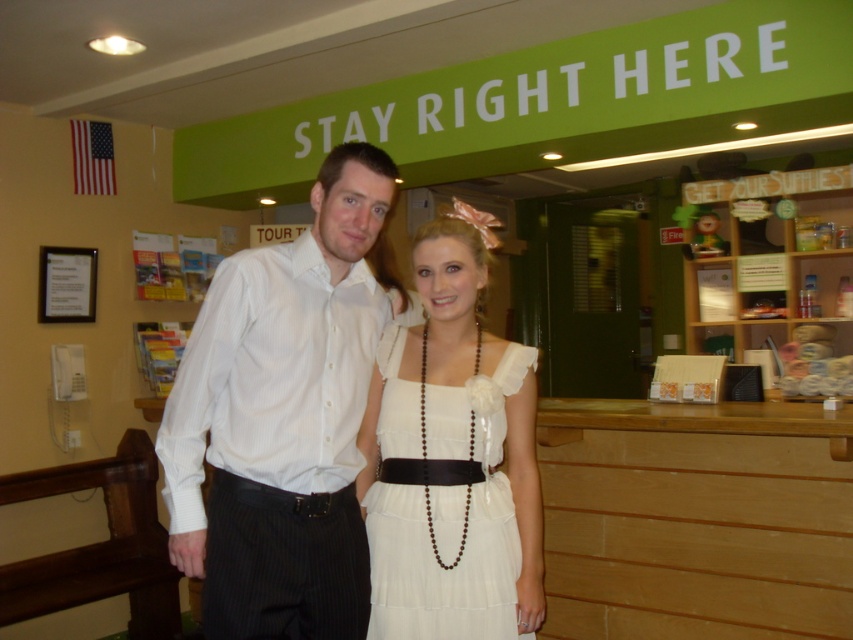
You are a photographer standing at the camera position. You want to place a 2.5 meter long banner between the wooden at right and the camera. Will the banner fit?

The wooden at right is 2.46 meters from the camera. The banner is 2.5 meters long, so it will not fit as the distance is slightly shorter than the banner.

What is the exact location of the white striped shirt at center in the image?

The white striped shirt at center is located at point 0.653 in the x coordinate and 0.333 in the y coordinate.

You are standing in the hotel lobby and want to find the wooden object at right. The wooden object at right is located at point (695, 518). Can you determine its position relative to the green sign?

The wooden object at right is located at point (695, 518), which is to the right side of the green sign.